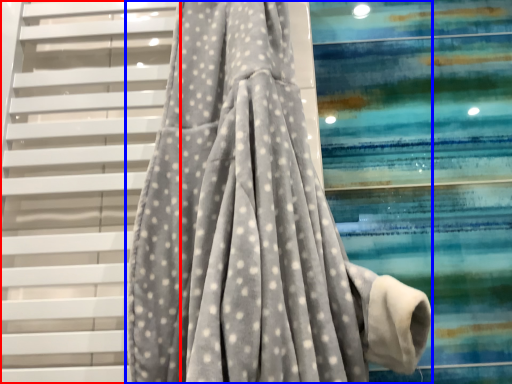
Question: Which object is further to the camera taking this photo, stairs (highlighted by a red box) or curtain (highlighted by a blue box)?

Choices:
 (A) stairs
 (B) curtain

Answer: (A)